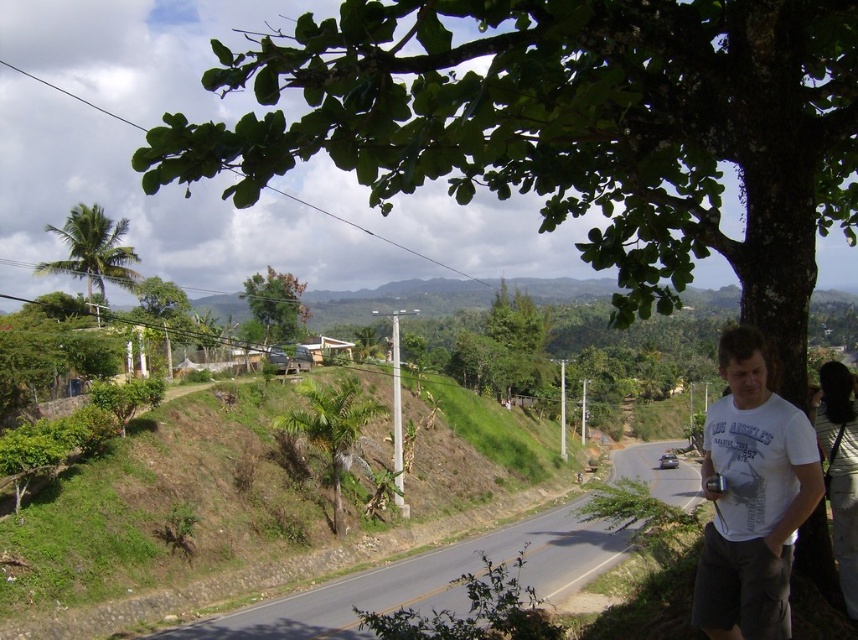
Question: Which object is positioned farthest from the green leafy palm tree at center-left?

Choices:
 (A) green leafy tree at upper center
 (B) white cotton shirt at right
 (C) green leafy palm tree at upper left
 (D) white cotton t-shirt at right

Answer: (B)

Question: Which point is closer to the camera?

Choices:
 (A) green leafy tree at upper center
 (B) green grassy hillside at lower left
 (C) white cotton shirt at right
 (D) green leafy palm tree at upper left

Answer: (C)

Question: Which point appears farthest from the camera in this image?

Choices:
 (A) (267, 276)
 (B) (843, 476)
 (C) (246, 497)
 (D) (379, 410)

Answer: (A)

Question: Is white cotton t-shirt at right wider than green leafy palm tree at center-left?

Choices:
 (A) no
 (B) yes

Answer: (A)

Question: Can you confirm if green grassy hillside at lower left is bigger than green leafy palm tree at center-left?

Choices:
 (A) no
 (B) yes

Answer: (B)

Question: Does green grassy hillside at lower left appear on the right side of green leafy tree at upper center?

Choices:
 (A) yes
 (B) no

Answer: (A)